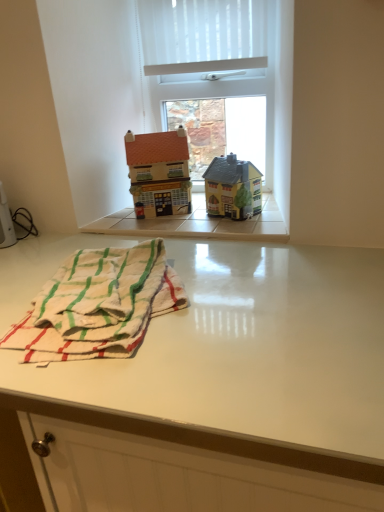
The height and width of the screenshot is (512, 384). I want to click on vacant region above white glossy table at lower center (from a real-world perspective), so click(185, 301).